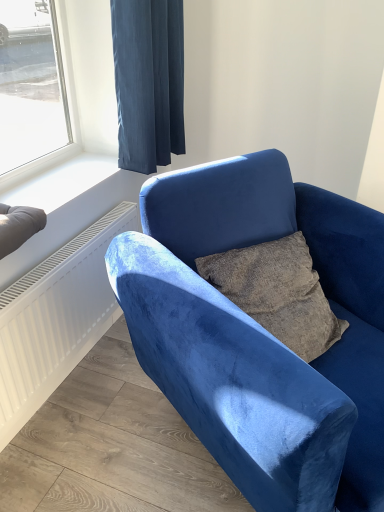
The image size is (384, 512). In order to click on velvet blue chair at center in this screenshot , I will do `click(261, 333)`.

Describe the element at coordinates (148, 81) in the screenshot. The image size is (384, 512). I see `dark blue velvet curtain at upper center` at that location.

I want to click on velvet blue chair at center, so click(261, 333).

From a real-world perspective, does dark blue velvet curtain at upper center sit lower than white smooth window sill at upper left?

Incorrect, from a real-world perspective, dark blue velvet curtain at upper center is higher than white smooth window sill at upper left.

Which of these two, dark blue velvet curtain at upper center or white smooth window sill at upper left, is thinner?

dark blue velvet curtain at upper center is thinner.

Based on the photo, can we say dark blue velvet curtain at upper center lies outside white smooth window sill at upper left?

dark blue velvet curtain at upper center is positioned outside white smooth window sill at upper left.

Which is in front, point (138, 77) or point (116, 164)?

Positioned in front is point (138, 77).

Does velvet blue chair at center appear on the right side of dark blue velvet curtain at upper center?

Yes, velvet blue chair at center is to the right of dark blue velvet curtain at upper center.

You are a GUI agent. You are given a task and a screenshot of the screen. Output one action in this format:
    pyautogui.click(x=<x>, y=<y>)
    Task: Click on the chair on the right of dark blue velvet curtain at upper center
    Image resolution: width=384 pixels, height=512 pixels.
    Given the screenshot: What is the action you would take?
    pyautogui.click(x=261, y=333)

Is velvet blue chair at center closer to the viewer compared to dark blue velvet curtain at upper center?

Yes, it is.

Could you tell me if velvet blue chair at center is turned towards dark blue velvet curtain at upper center?

No, velvet blue chair at center is not turned towards dark blue velvet curtain at upper center.

Consider the image. Could you tell me if white smooth window sill at upper left is turned towards dark blue velvet curtain at upper center?

No.

Is white smooth window sill at upper left wider or thinner than dark blue velvet curtain at upper center?

Clearly, white smooth window sill at upper left has more width compared to dark blue velvet curtain at upper center.

Can dark blue velvet curtain at upper center be found inside white smooth window sill at upper left?

Actually, dark blue velvet curtain at upper center is outside white smooth window sill at upper left.

Can you confirm if white smooth window sill at upper left is positioned to the left of dark blue velvet curtain at upper center?

Yes, white smooth window sill at upper left is to the left of dark blue velvet curtain at upper center.

Measure the distance from velvet blue chair at center to white smooth window sill at upper left.

velvet blue chair at center and white smooth window sill at upper left are 28.57 inches apart.

Is velvet blue chair at center looking in the opposite direction of white smooth window sill at upper left?

Yes.

Which is in front, point (381, 223) or point (93, 166)?

The point (381, 223) is closer to the camera.

Based on the photo, considering the sizes of objects velvet blue chair at center and white smooth window sill at upper left in the image provided, who is wider, velvet blue chair at center or white smooth window sill at upper left?

velvet blue chair at center.

Between dark blue velvet curtain at upper center and velvet blue chair at center, which one appears on the right side from the viewer's perspective?

velvet blue chair at center is more to the right.

Is dark blue velvet curtain at upper center placed right next to velvet blue chair at center?

dark blue velvet curtain at upper center is not next to velvet blue chair at center, and they're not touching.

This screenshot has height=512, width=384. Identify the location of chair that appears below the dark blue velvet curtain at upper center (from a real-world perspective). (261, 333).

Is white smooth window sill at upper left positioned far away from velvet blue chair at center?

No, there isn't a large distance between white smooth window sill at upper left and velvet blue chair at center.

Is white smooth window sill at upper left shorter than velvet blue chair at center?

Yes, white smooth window sill at upper left is shorter than velvet blue chair at center.

Is white smooth window sill at upper left wider or thinner than velvet blue chair at center?

Considering their sizes, white smooth window sill at upper left looks slimmer than velvet blue chair at center.

Does point (68, 195) come behind point (246, 337)?

Yes, point (68, 195) is farther from viewer.

The height and width of the screenshot is (512, 384). Identify the location of window sill that is under the dark blue velvet curtain at upper center (from a real-world perspective). (61, 182).

Locate an element on the screen. curtain on the left of velvet blue chair at center is located at coordinates (148, 81).

When comparing their distances from white smooth window sill at upper left, does velvet blue chair at center or dark blue velvet curtain at upper center seem closer?

The object closer to white smooth window sill at upper left is dark blue velvet curtain at upper center.

Looking at this image, considering their positions, is velvet blue chair at center positioned closer to dark blue velvet curtain at upper center than white smooth window sill at upper left?

white smooth window sill at upper left lies closer to dark blue velvet curtain at upper center than the other object.

Considering their positions, is dark blue velvet curtain at upper center positioned closer to white smooth window sill at upper left than velvet blue chair at center?

dark blue velvet curtain at upper center is closer to white smooth window sill at upper left.

Estimate the real-world distances between objects in this image. Which object is closer to dark blue velvet curtain at upper center, white smooth window sill at upper left or velvet blue chair at center?

white smooth window sill at upper left is positioned closer to the anchor dark blue velvet curtain at upper center.

From the image, which object appears to be nearer to velvet blue chair at center, white smooth window sill at upper left or dark blue velvet curtain at upper center?

Among the two, white smooth window sill at upper left is located nearer to velvet blue chair at center.

Considering their positions, is dark blue velvet curtain at upper center positioned further to velvet blue chair at center than white smooth window sill at upper left?

Among the two, dark blue velvet curtain at upper center is located further to velvet blue chair at center.

This screenshot has width=384, height=512. What are the coordinates of `curtain positioned between velvet blue chair at center and white smooth window sill at upper left from near to far` in the screenshot? It's located at (148, 81).